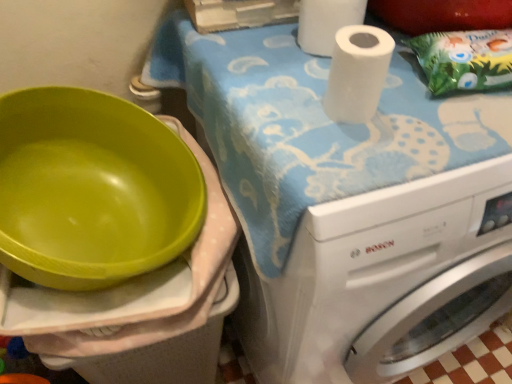
Locate an element on the screen. free location to the left of green paper bag at upper right is located at coordinates (379, 95).